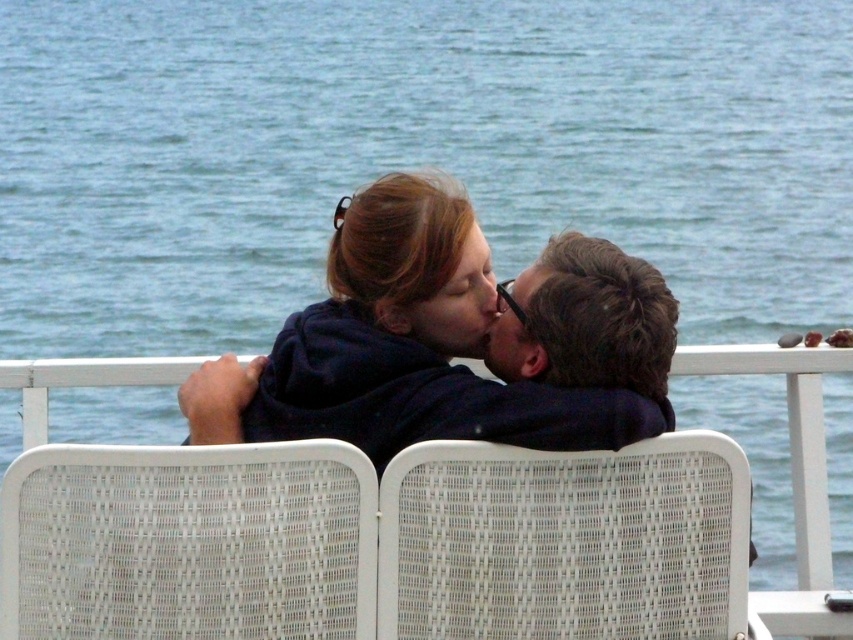
In the scene shown: Who is more forward, (x=422, y=378) or (x=660, y=422)?

Point (x=660, y=422) is more forward.

Describe the element at coordinates (451, 340) in the screenshot. Image resolution: width=853 pixels, height=640 pixels. I see `dark blue hoodie at center` at that location.

Find the location of a particular element. This screenshot has height=640, width=853. dark blue hoodie at center is located at coordinates (451, 340).